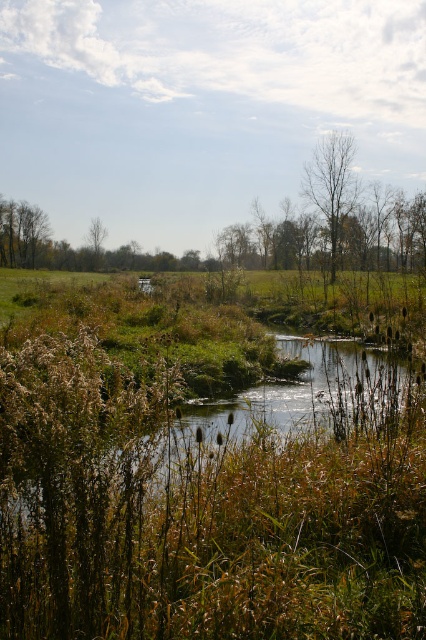
Question: Does bare wood tree at upper center come in front of green leafy tree at left?

Choices:
 (A) yes
 (B) no

Answer: (A)

Question: Is bare wood tree at upper center bigger than green leafy tree at left?

Choices:
 (A) yes
 (B) no

Answer: (A)

Question: Does bare wood tree at upper center appear on the right side of green leafy tree at left?

Choices:
 (A) no
 (B) yes

Answer: (B)

Question: Which of the following is the closest to the observer?

Choices:
 (A) green leafy tree at left
 (B) bare wood tree at upper center

Answer: (B)